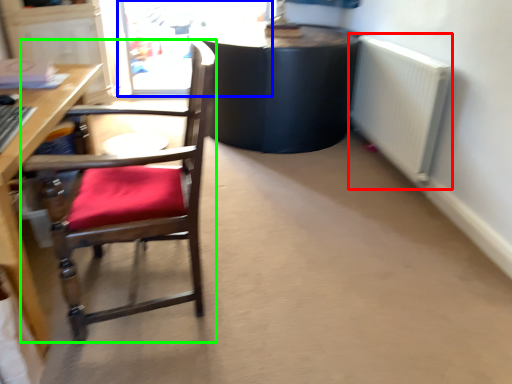
Question: Based on their relative distances, which object is nearer to radiator (highlighted by a red box)? Choose from screen door (highlighted by a blue box) and chair (highlighted by a green box).

Choices:
 (A) screen door
 (B) chair

Answer: (B)